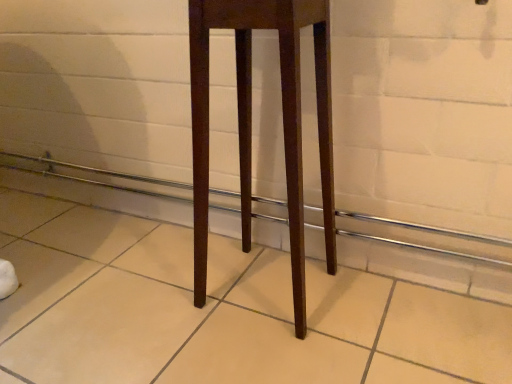
What are the coordinates of `vacant space to the left of mahogany wood stool at center` in the screenshot? It's located at (156, 302).